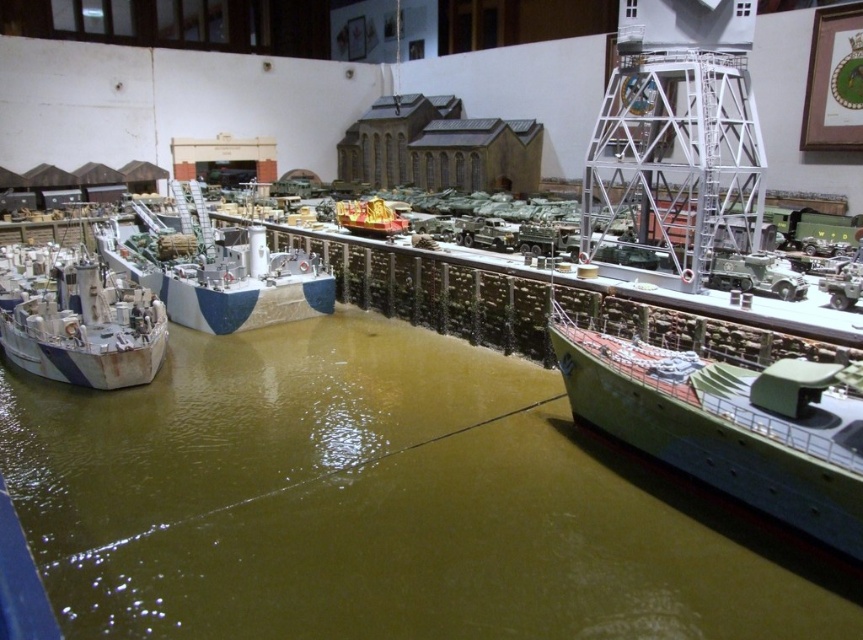
You are a visitor at the museum and want to take a photo of the green matte ship at center without the green matte water at center blocking the view. Is this possible given their positions?

The green matte water at center is in front of the green matte ship at center, so it will block the view of the ship. You cannot take a photo of the green matte ship at center without the green matte water at center blocking it.

You are a visitor standing in front of the diorama. The green matte ship at center is part of the display. If you want to take a photo of it without any obstruction, how far back should you step to ensure the entire ship fits in your camera frame?

The green matte ship at center is positioned 17.49 feet away from the viewer. To capture the entire ship in your camera frame without obstruction, you should step back approximately 17.49 feet to ensure proper framing.